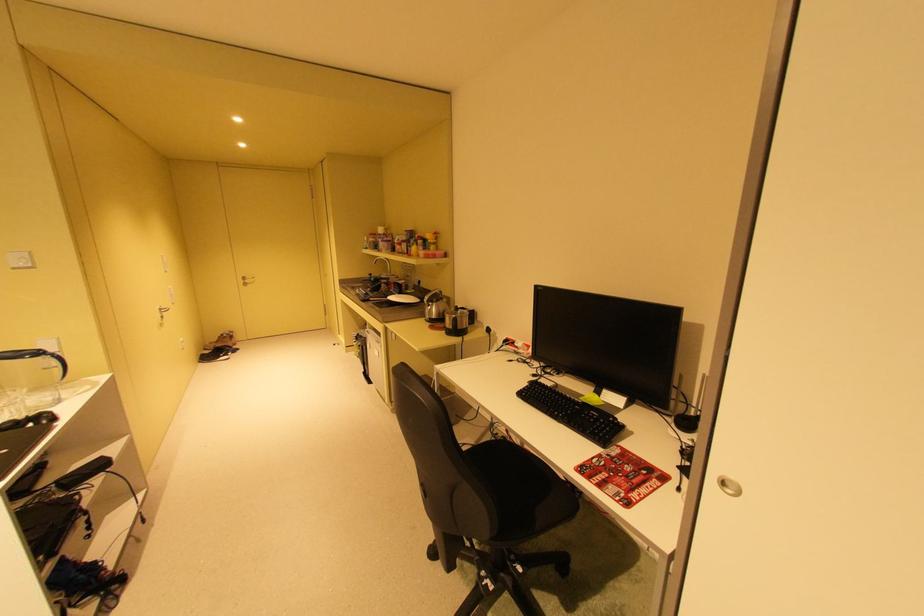
The location [572,413] corresponds to which object?

This point indicates the black keyboard.